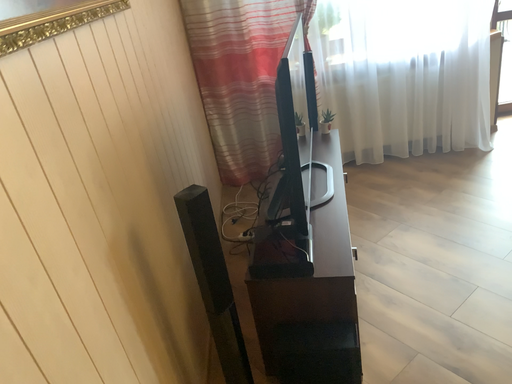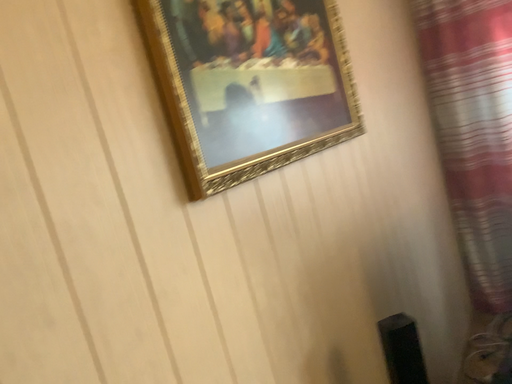
Question: How did the camera likely rotate when shooting the video?

Choices:
 (A) rotated upward
 (B) rotated downward

Answer: (A)